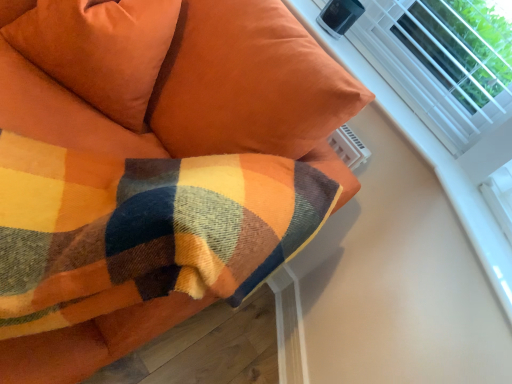
Question: Can you confirm if plaid wool blanket at upper left is smaller than suede-like orange pillow at upper left?

Choices:
 (A) no
 (B) yes

Answer: (A)

Question: Would you consider plaid wool blanket at upper left to be distant from suede-like orange pillow at upper left?

Choices:
 (A) yes
 (B) no

Answer: (B)

Question: From the image's perspective, would you say plaid wool blanket at upper left is shown under suede-like orange pillow at upper left?

Choices:
 (A) no
 (B) yes

Answer: (B)

Question: From a real-world perspective, is plaid wool blanket at upper left on suede-like orange pillow at upper left?

Choices:
 (A) no
 (B) yes

Answer: (A)

Question: Considering the relative sizes of plaid wool blanket at upper left and suede-like orange pillow at upper left in the image provided, is plaid wool blanket at upper left taller than suede-like orange pillow at upper left?

Choices:
 (A) yes
 (B) no

Answer: (A)

Question: Considering the positions of point (365, 33) and point (249, 100), is point (365, 33) closer or farther from the camera than point (249, 100)?

Choices:
 (A) farther
 (B) closer

Answer: (A)

Question: Based on their sizes in the image, would you say white plastic radiator at upper right is bigger or smaller than plaid wool blanket at upper left?

Choices:
 (A) small
 (B) big

Answer: (A)

Question: Looking at their shapes, would you say white plastic radiator at upper right is wider or thinner than plaid wool blanket at upper left?

Choices:
 (A) thin
 (B) wide

Answer: (A)

Question: Is white plastic radiator at upper right inside or outside of plaid wool blanket at upper left?

Choices:
 (A) inside
 (B) outside

Answer: (B)

Question: In the image, is plaid wool blanket at upper left positioned in front of or behind white plastic radiator at upper right?

Choices:
 (A) front
 (B) behind

Answer: (A)

Question: In terms of size, does plaid wool blanket at upper left appear bigger or smaller than white plastic radiator at upper right?

Choices:
 (A) big
 (B) small

Answer: (A)

Question: Looking at their shapes, would you say plaid wool blanket at upper left is wider or thinner than white plastic radiator at upper right?

Choices:
 (A) wide
 (B) thin

Answer: (A)

Question: Is plaid wool blanket at upper left spatially inside white plastic radiator at upper right, or outside of it?

Choices:
 (A) outside
 (B) inside

Answer: (A)

Question: From a real-world perspective, is plaid wool blanket at upper left above or below suede-like orange pillow at upper left?

Choices:
 (A) above
 (B) below

Answer: (B)

Question: Is plaid wool blanket at upper left wider or thinner than suede-like orange pillow at upper left?

Choices:
 (A) thin
 (B) wide

Answer: (B)